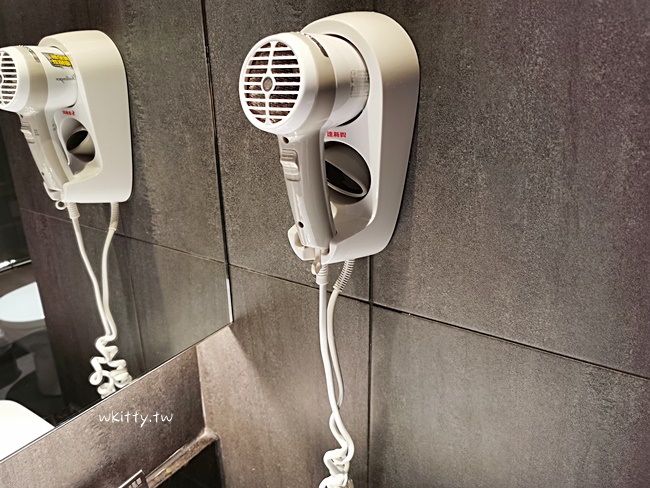
What are the coordinates of `on and off switch` in the screenshot? It's located at (286, 159).